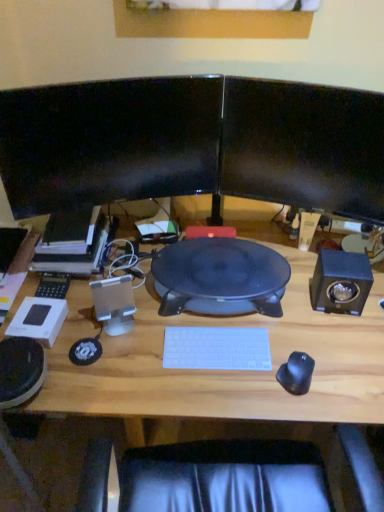
Question: From the image's perspective, is satin black speaker at right, positioned as the second speaker in left-to-right order, under black glossy monitor at upper center, arranged as the first computer monitor when viewed from the right?

Choices:
 (A) yes
 (B) no

Answer: (A)

Question: Is satin black speaker at right, which ranks as the 1th speaker in right-to-left order, wider than black glossy monitor at upper center, arranged as the first computer monitor when viewed from the right?

Choices:
 (A) yes
 (B) no

Answer: (A)

Question: Is satin black speaker at right, which ranks as the 1th speaker in right-to-left order, looking in the opposite direction of black glossy monitor at upper center, arranged as the first computer monitor when viewed from the right?

Choices:
 (A) yes
 (B) no

Answer: (B)

Question: Is satin black speaker at right, positioned as the second speaker in left-to-right order, not inside black glossy monitor at upper center, which ranks as the second computer monitor in left-to-right order?

Choices:
 (A) no
 (B) yes

Answer: (B)

Question: From a real-world perspective, is satin black speaker at right, positioned as the second speaker in left-to-right order, positioned under black glossy monitor at upper center, which ranks as the second computer monitor in left-to-right order, based on gravity?

Choices:
 (A) no
 (B) yes

Answer: (B)

Question: Is satin black speaker at right, positioned as the second speaker in left-to-right order, far away from black glossy monitor at upper center, which ranks as the second computer monitor in left-to-right order?

Choices:
 (A) no
 (B) yes

Answer: (A)

Question: Can you confirm if black glossy monitor at upper center, which ranks as the second computer monitor in left-to-right order, is positioned to the left of black glossy monitor at upper left, acting as the first computer monitor starting from the left?

Choices:
 (A) no
 (B) yes

Answer: (A)

Question: From a real-world perspective, is black glossy monitor at upper center, which ranks as the second computer monitor in left-to-right order, located beneath black glossy monitor at upper left, which is the 2th computer monitor in right-to-left order?

Choices:
 (A) no
 (B) yes

Answer: (A)

Question: Is black glossy monitor at upper left, acting as the first computer monitor starting from the left, surrounded by black glossy monitor at upper center, which ranks as the second computer monitor in left-to-right order?

Choices:
 (A) no
 (B) yes

Answer: (A)

Question: Is black glossy monitor at upper center, which ranks as the second computer monitor in left-to-right order, further to the viewer compared to black glossy monitor at upper left, acting as the first computer monitor starting from the left?

Choices:
 (A) no
 (B) yes

Answer: (A)

Question: Does black glossy monitor at upper center, arranged as the first computer monitor when viewed from the right, touch black glossy monitor at upper left, which is the 2th computer monitor in right-to-left order?

Choices:
 (A) no
 (B) yes

Answer: (A)

Question: Considering the relative positions of black glossy monitor at upper center, which ranks as the second computer monitor in left-to-right order, and black glossy monitor at upper left, which is the 2th computer monitor in right-to-left order, in the image provided, is black glossy monitor at upper center, which ranks as the second computer monitor in left-to-right order, to the right of black glossy monitor at upper left, which is the 2th computer monitor in right-to-left order, from the viewer's perspective?

Choices:
 (A) no
 (B) yes

Answer: (B)

Question: Is black glossy monitor at upper center, which ranks as the second computer monitor in left-to-right order, turned away from satin black speaker at right, positioned as the second speaker in left-to-right order?

Choices:
 (A) yes
 (B) no

Answer: (B)